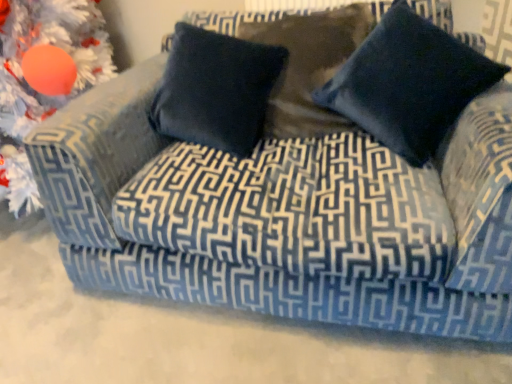
Question: From their relative heights in the image, would you say orange matte ornament at upper left is taller or shorter than navy blue velvet pillow at center, the first pillow positioned from the left?

Choices:
 (A) tall
 (B) short

Answer: (A)

Question: Choose the correct answer: Is orange matte ornament at upper left inside navy blue velvet pillow at center, the first pillow positioned from the left, or outside it?

Choices:
 (A) inside
 (B) outside

Answer: (B)

Question: Estimate the real-world distances between objects in this image. Which object is closer to the navy blue velvet pillow at center, the first pillow positioned from the left?

Choices:
 (A) orange matte ornament at upper left
 (B) navy velvet pillow at upper right, the 2th pillow in the left-to-right sequence

Answer: (B)

Question: Based on their relative distances, which object is farther from the navy blue velvet pillow at center, the first pillow positioned from the left?

Choices:
 (A) orange matte ornament at upper left
 (B) navy velvet pillow at upper right, which ranks as the 1th pillow in right-to-left order

Answer: (A)